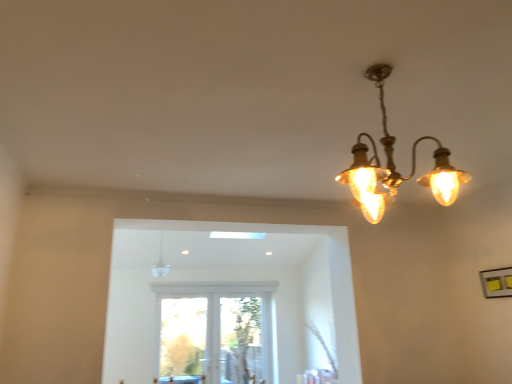
Describe the element at coordinates (160, 262) in the screenshot. This screenshot has width=512, height=384. I see `clear glass pendant light at upper center, placed as the 2th lamp when sorted from front to back` at that location.

Locate an element on the screen. This screenshot has height=384, width=512. clear glass pendant light at upper center, the 2th lamp viewed from the right is located at coordinates (160, 262).

In order to face matte brass chandelier at upper right, positioned as the first lamp in right-to-left order, should I rotate leftwards or rightwards?

To align with it, rotate right about 15.890°.

What is the approximate height of matte brass chandelier at upper right, placed as the 2th lamp when sorted from left to right?

It is 20.90 inches.

From the picture: Measure the distance between matte brass chandelier at upper right, which is counted as the 2th lamp, starting from the bottom, and camera.

1.49 meters.

What do you see at coordinates (395, 166) in the screenshot? This screenshot has height=384, width=512. I see `matte brass chandelier at upper right, positioned as the first lamp in right-to-left order` at bounding box center [395, 166].

Identify the location of matte brass chandelier at upper right, placed as the 2th lamp when sorted from left to right. The width and height of the screenshot is (512, 384). (395, 166).

In order to click on clear glass pendant light at upper center, the 2th lamp viewed from the right in this screenshot , I will do `click(160, 262)`.

Between matte brass chandelier at upper right, which is the 1th lamp from top to bottom, and clear glass pendant light at upper center, placed as the 2th lamp when sorted from front to back, which one appears on the right side from the viewer's perspective?

matte brass chandelier at upper right, which is the 1th lamp from top to bottom, is more to the right.

Is the depth of matte brass chandelier at upper right, which ranks as the first lamp in front-to-back order, less than that of clear glass pendant light at upper center, the 2th lamp viewed from the right?

Yes, matte brass chandelier at upper right, which ranks as the first lamp in front-to-back order, is in front of clear glass pendant light at upper center, the 2th lamp viewed from the right.

Does point (387, 130) lie in front of point (166, 265)?

Yes, it is in front of point (166, 265).

From the image's perspective, which object appears higher, matte brass chandelier at upper right, positioned as the first lamp in right-to-left order, or clear glass pendant light at upper center, which is counted as the 2th lamp, starting from the top?

matte brass chandelier at upper right, positioned as the first lamp in right-to-left order, appears higher in the image.

From a real-world perspective, is matte brass chandelier at upper right, which ranks as the first lamp in front-to-back order, positioned above or below clear glass pendant light at upper center, the 2th lamp viewed from the right?

matte brass chandelier at upper right, which ranks as the first lamp in front-to-back order, is below clear glass pendant light at upper center, the 2th lamp viewed from the right.

Which of these two, matte brass chandelier at upper right, which is counted as the 2th lamp, starting from the bottom, or clear glass pendant light at upper center, the first lamp viewed from the back, is thinner?

clear glass pendant light at upper center, the first lamp viewed from the back.

From their relative heights in the image, would you say matte brass chandelier at upper right, which ranks as the first lamp in front-to-back order, is taller or shorter than clear glass pendant light at upper center, placed as the 2th lamp when sorted from front to back?

matte brass chandelier at upper right, which ranks as the first lamp in front-to-back order, is taller than clear glass pendant light at upper center, placed as the 2th lamp when sorted from front to back.

Can you confirm if matte brass chandelier at upper right, marked as the second lamp in a back-to-front arrangement, is bigger than clear glass pendant light at upper center, the first lamp viewed from the back?

Yes.

Would you say matte brass chandelier at upper right, placed as the 2th lamp when sorted from left to right, is inside or outside clear glass pendant light at upper center, which is counted as the 2th lamp, starting from the top?

matte brass chandelier at upper right, placed as the 2th lamp when sorted from left to right, is not enclosed by clear glass pendant light at upper center, which is counted as the 2th lamp, starting from the top.

Is matte brass chandelier at upper right, positioned as the first lamp in right-to-left order, not close to clear glass pendant light at upper center, which is counted as the 2th lamp, starting from the top?

Indeed, matte brass chandelier at upper right, positioned as the first lamp in right-to-left order, is not near clear glass pendant light at upper center, which is counted as the 2th lamp, starting from the top.

Is matte brass chandelier at upper right, placed as the 2th lamp when sorted from left to right, looking in the opposite direction of clear glass pendant light at upper center, the 2th lamp viewed from the right?

No, matte brass chandelier at upper right, placed as the 2th lamp when sorted from left to right,'s orientation is not away from clear glass pendant light at upper center, the 2th lamp viewed from the right.

Identify the location of lamp in front of the clear glass pendant light at upper center, the first lamp positioned from the left. The image size is (512, 384). tap(395, 166).

Which is more to the left, clear glass pendant light at upper center, placed as the 2th lamp when sorted from front to back, or matte brass chandelier at upper right, marked as the second lamp in a back-to-front arrangement?

clear glass pendant light at upper center, placed as the 2th lamp when sorted from front to back, is more to the left.

Is clear glass pendant light at upper center, which is counted as the 2th lamp, starting from the top, behind matte brass chandelier at upper right, positioned as the first lamp in right-to-left order?

Yes, it is behind matte brass chandelier at upper right, positioned as the first lamp in right-to-left order.

Does point (160, 252) come behind point (370, 171)?

That is True.

From the image's perspective, is clear glass pendant light at upper center, which is counted as the 1th lamp, starting from the bottom, on top of matte brass chandelier at upper right, which is counted as the 2th lamp, starting from the bottom?

No, from the image's perspective, clear glass pendant light at upper center, which is counted as the 1th lamp, starting from the bottom, is not above matte brass chandelier at upper right, which is counted as the 2th lamp, starting from the bottom.

From a real-world perspective, is clear glass pendant light at upper center, which is counted as the 2th lamp, starting from the top, beneath matte brass chandelier at upper right, which is the 1th lamp from top to bottom?

Incorrect, from a real-world perspective, clear glass pendant light at upper center, which is counted as the 2th lamp, starting from the top, is higher than matte brass chandelier at upper right, which is the 1th lamp from top to bottom.

In the scene shown: Considering the sizes of clear glass pendant light at upper center, placed as the 2th lamp when sorted from front to back, and matte brass chandelier at upper right, positioned as the first lamp in right-to-left order, in the image, is clear glass pendant light at upper center, placed as the 2th lamp when sorted from front to back, wider or thinner than matte brass chandelier at upper right, positioned as the first lamp in right-to-left order,?

clear glass pendant light at upper center, placed as the 2th lamp when sorted from front to back, is thinner than matte brass chandelier at upper right, positioned as the first lamp in right-to-left order.

In terms of height, does clear glass pendant light at upper center, the first lamp positioned from the left, look taller or shorter compared to matte brass chandelier at upper right, placed as the 2th lamp when sorted from left to right?

Considering their sizes, clear glass pendant light at upper center, the first lamp positioned from the left, has less height than matte brass chandelier at upper right, placed as the 2th lamp when sorted from left to right.

Considering the sizes of objects clear glass pendant light at upper center, the first lamp positioned from the left, and matte brass chandelier at upper right, which is the 1th lamp from top to bottom, in the image provided, who is smaller, clear glass pendant light at upper center, the first lamp positioned from the left, or matte brass chandelier at upper right, which is the 1th lamp from top to bottom,?

clear glass pendant light at upper center, the first lamp positioned from the left.

Looking at this image, do you think clear glass pendant light at upper center, the 2th lamp viewed from the right, is within matte brass chandelier at upper right, which ranks as the first lamp in front-to-back order, or outside of it?

The correct answer is: outside.

Is clear glass pendant light at upper center, placed as the 2th lamp when sorted from front to back, next to matte brass chandelier at upper right, which is the 1th lamp from top to bottom, and touching it?

No, clear glass pendant light at upper center, placed as the 2th lamp when sorted from front to back, is not touching matte brass chandelier at upper right, which is the 1th lamp from top to bottom.

Consider the image. Is clear glass pendant light at upper center, the first lamp positioned from the left, oriented away from matte brass chandelier at upper right, placed as the 2th lamp when sorted from left to right?

clear glass pendant light at upper center, the first lamp positioned from the left, does not have its back to matte brass chandelier at upper right, placed as the 2th lamp when sorted from left to right.

Find the location of a particular element. lamp on the right of clear glass pendant light at upper center, which is counted as the 2th lamp, starting from the top is located at coordinates (395, 166).

Find the location of a particular element. This screenshot has height=384, width=512. lamp above the clear glass pendant light at upper center, the first lamp viewed from the back (from the image's perspective) is located at coordinates (395, 166).

I want to click on lamp that appears behind the matte brass chandelier at upper right, which is the 1th lamp from top to bottom, so click(160, 262).